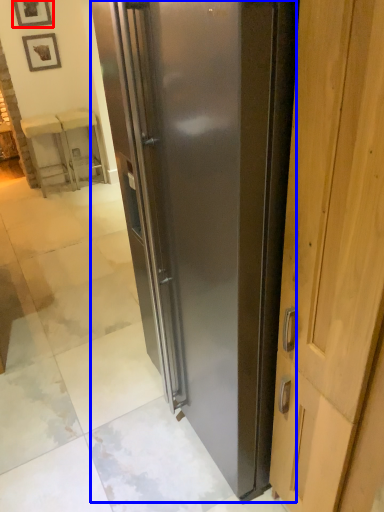
Question: Which point is further to the camera, picture frame (highlighted by a red box) or refrigerator (highlighted by a blue box)?

Choices:
 (A) picture frame
 (B) refrigerator

Answer: (A)